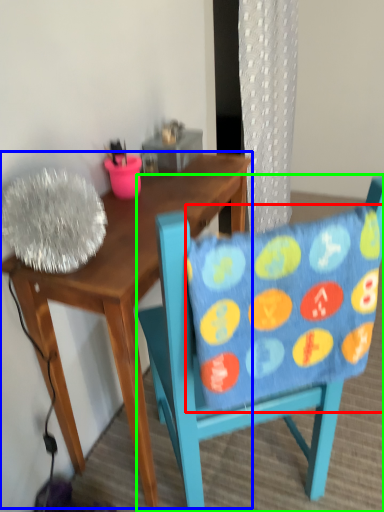
Question: Considering the real-world distances, which object is closest to pillow (highlighted by a red box)? desk (highlighted by a blue box) or chair (highlighted by a green box).

Choices:
 (A) desk
 (B) chair

Answer: (B)